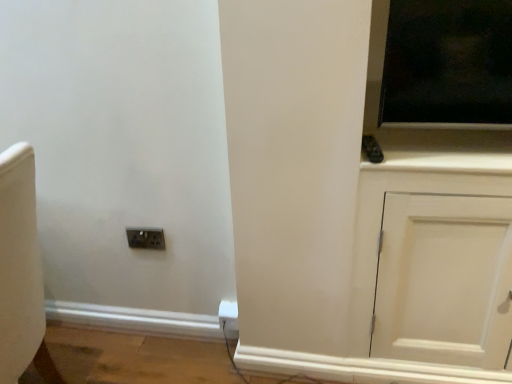
Question: Is the position of white plastic electric outlet at lower center more distant than that of metallic socket at lower left?

Choices:
 (A) no
 (B) yes

Answer: (B)

Question: Is metallic socket at lower left at the back of white plastic electric outlet at lower center?

Choices:
 (A) no
 (B) yes

Answer: (A)

Question: Could you tell me if white plastic electric outlet at lower center is turned towards metallic socket at lower left?

Choices:
 (A) no
 (B) yes

Answer: (A)

Question: From a real-world perspective, is white plastic electric outlet at lower center physically below metallic socket at lower left?

Choices:
 (A) no
 (B) yes

Answer: (B)

Question: Can you confirm if white plastic electric outlet at lower center is taller than metallic socket at lower left?

Choices:
 (A) yes
 (B) no

Answer: (A)

Question: From the image's perspective, does white plastic electric outlet at lower center appear lower than metallic socket at lower left?

Choices:
 (A) no
 (B) yes

Answer: (B)

Question: Can you confirm if white matte cabinet at right is shorter than white plastic electric outlet at lower center?

Choices:
 (A) no
 (B) yes

Answer: (A)

Question: From the image's perspective, would you say white matte cabinet at right is positioned over white plastic electric outlet at lower center?

Choices:
 (A) yes
 (B) no

Answer: (A)

Question: Does white matte cabinet at right have a larger size compared to white plastic electric outlet at lower center?

Choices:
 (A) no
 (B) yes

Answer: (B)

Question: Is white matte cabinet at right located outside white plastic electric outlet at lower center?

Choices:
 (A) yes
 (B) no

Answer: (A)

Question: Considering the relative positions of white matte cabinet at right and white plastic electric outlet at lower center in the image provided, is white matte cabinet at right in front of white plastic electric outlet at lower center?

Choices:
 (A) no
 (B) yes

Answer: (B)

Question: Does white matte cabinet at right have a greater height compared to white plastic electric outlet at lower center?

Choices:
 (A) yes
 (B) no

Answer: (A)

Question: Does metallic socket at lower left appear on the left side of white matte cabinet at right?

Choices:
 (A) no
 (B) yes

Answer: (B)